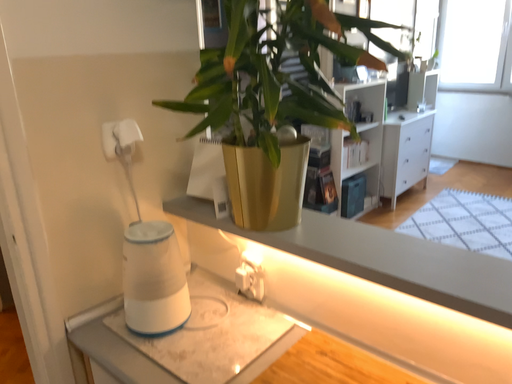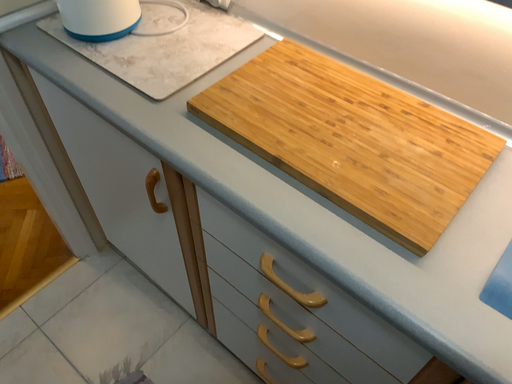
Question: How did the camera likely rotate when shooting the video?

Choices:
 (A) rotated upward
 (B) rotated downward

Answer: (B)